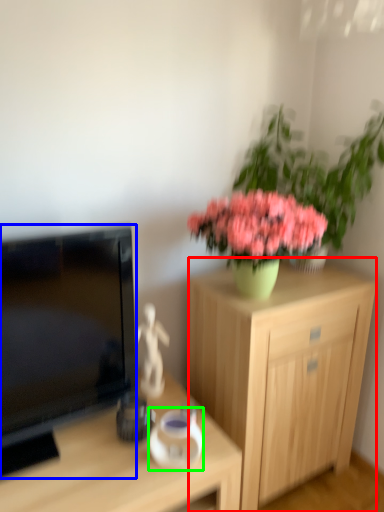
Question: Based on their relative distances, which object is farther from cabinetry (highlighted by a red box)? Choose from television (highlighted by a blue box) and vase (highlighted by a green box).

Choices:
 (A) television
 (B) vase

Answer: (A)